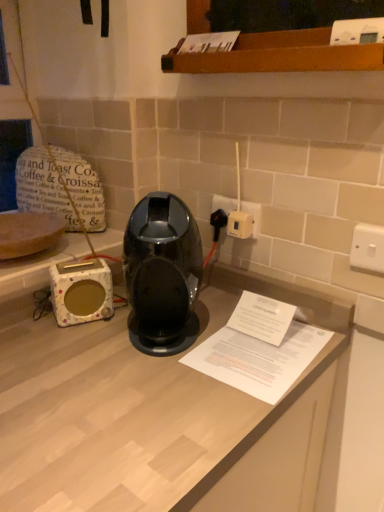
Question: Considering the relative sizes of white ceramic toaster at left and white paper at center in the image provided, is white ceramic toaster at left taller than white paper at center?

Choices:
 (A) yes
 (B) no

Answer: (A)

Question: Is white ceramic toaster at left not inside white paper at center?

Choices:
 (A) no
 (B) yes

Answer: (B)

Question: Can you confirm if white ceramic toaster at left is bigger than white paper at center?

Choices:
 (A) yes
 (B) no

Answer: (B)

Question: Could white paper at center be considered to be inside white ceramic toaster at left?

Choices:
 (A) yes
 (B) no

Answer: (B)

Question: Is white ceramic toaster at left turned away from white paper at center?

Choices:
 (A) yes
 (B) no

Answer: (B)

Question: From the image's perspective, relative to white paper at center, is white plastic plug at center-right, placed as the 2th electric outlet when sorted from front to back, above or below?

Choices:
 (A) below
 (B) above

Answer: (B)

Question: Looking at the image, does white plastic plug at center-right, placed as the 2th electric outlet when sorted from front to back, seem bigger or smaller compared to white paper at center?

Choices:
 (A) small
 (B) big

Answer: (A)

Question: Is white plastic plug at center-right, acting as the second electric outlet starting from the right, inside or outside of white paper at center?

Choices:
 (A) inside
 (B) outside

Answer: (B)

Question: Considering the positions of white plastic plug at center-right, acting as the second electric outlet starting from the right, and white paper at center in the image, is white plastic plug at center-right, acting as the second electric outlet starting from the right, wider or thinner than white paper at center?

Choices:
 (A) thin
 (B) wide

Answer: (A)

Question: Considering the positions of white ceramic toaster at left and white plastic switch at upper right, the second electric outlet when ordered from back to front, in the image, is white ceramic toaster at left bigger or smaller than white plastic switch at upper right, the second electric outlet when ordered from back to front,?

Choices:
 (A) big
 (B) small

Answer: (A)

Question: Visually, is white ceramic toaster at left positioned to the left or to the right of white plastic switch at upper right, the 2th electric outlet when ordered from left to right?

Choices:
 (A) left
 (B) right

Answer: (A)

Question: Considering the positions of white ceramic toaster at left and white plastic switch at upper right, the 2th electric outlet when ordered from left to right, in the image, is white ceramic toaster at left wider or thinner than white plastic switch at upper right, the 2th electric outlet when ordered from left to right,?

Choices:
 (A) wide
 (B) thin

Answer: (A)

Question: From a real-world perspective, relative to white plastic switch at upper right, placed as the first electric outlet when sorted from right to left, is white ceramic toaster at left vertically above or below?

Choices:
 (A) above
 (B) below

Answer: (B)

Question: Is point (365, 259) closer or farther from the camera than point (233, 207)?

Choices:
 (A) farther
 (B) closer

Answer: (B)

Question: Based on their positions, is white plastic switch at upper right, which is the first electric outlet from front to back, located to the left or right of white plastic plug at center-right, the first electric outlet from the back?

Choices:
 (A) left
 (B) right

Answer: (B)